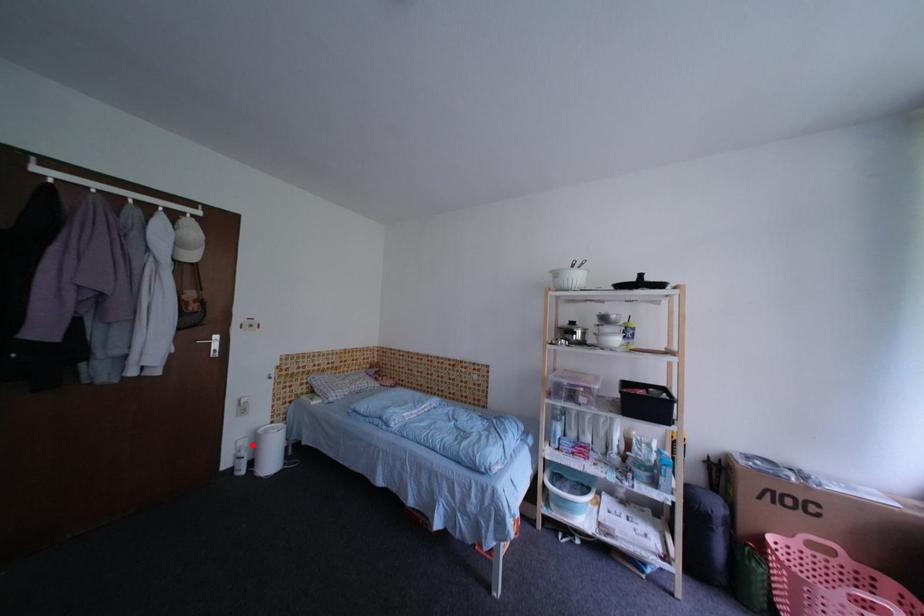
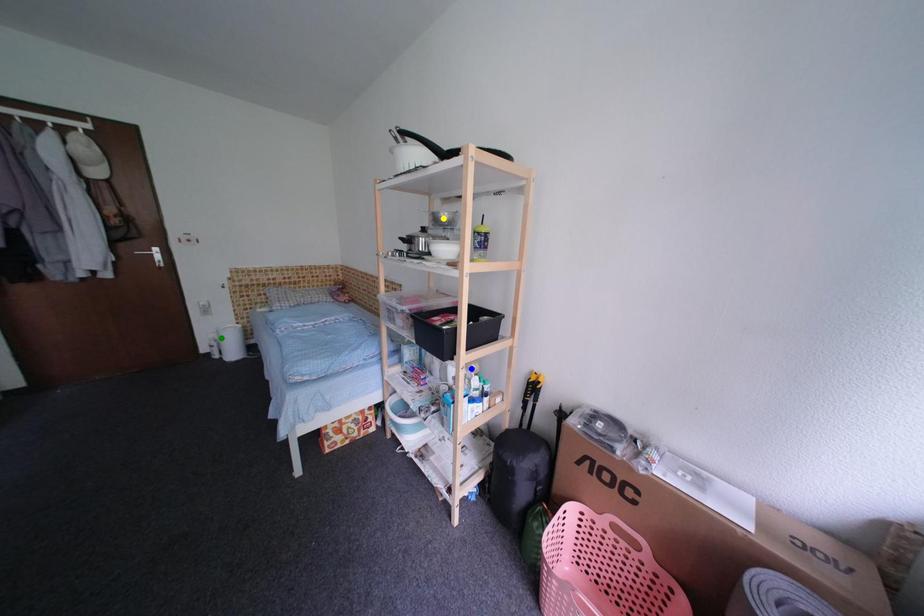
Question: I am providing you with two images of the same scene from different viewpoints. A red point is marked on the first image. You are given multiple points on the second image. Can you choose the point in image 2 that corresponds to the point in image 1?

Choices:
 (A) green point
 (B) blue point
 (C) yellow point

Answer: (A)